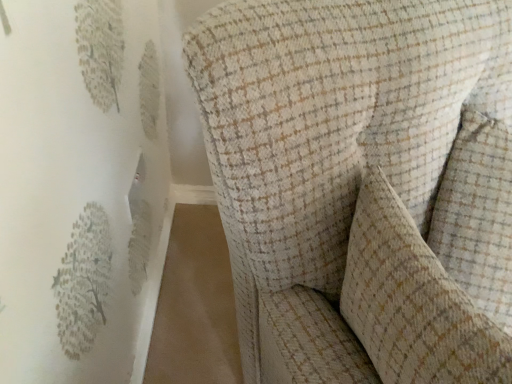
This screenshot has width=512, height=384. In order to click on textured beige pillow at upper right in this screenshot , I will do `click(413, 301)`.

What do you see at coordinates (413, 301) in the screenshot? I see `textured beige pillow at upper right` at bounding box center [413, 301].

Where is `textured beige pillow at upper right`? The width and height of the screenshot is (512, 384). textured beige pillow at upper right is located at coordinates (413, 301).